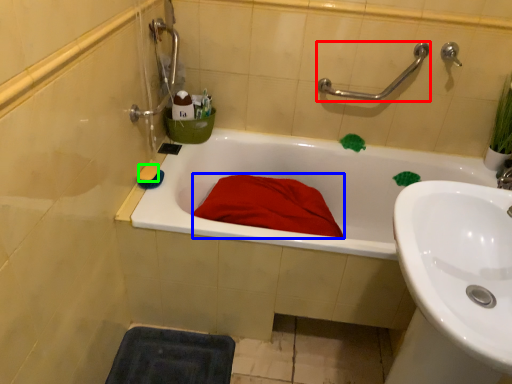
Question: Estimate the real-world distances between objects in this image. Which object is farther from shower (highlighted by a red box), blanket (highlighted by a blue box) or soap (highlighted by a green box)?

Choices:
 (A) blanket
 (B) soap

Answer: (B)